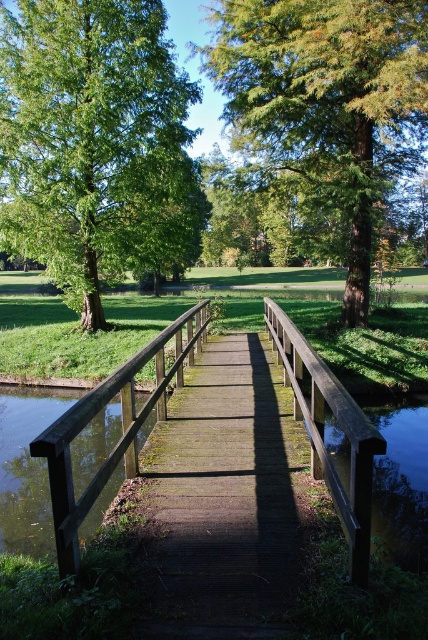
Question: Can you confirm if mossy wooden bridge at center is positioned below wooden bridge at center?

Choices:
 (A) yes
 (B) no

Answer: (A)

Question: Does green matte tree at upper left have a larger size compared to green leafy tree at center?

Choices:
 (A) no
 (B) yes

Answer: (A)

Question: Which point is closer to the camera?

Choices:
 (A) green leafy tree at center
 (B) wooden bridge at center
 (C) mossy wooden bridge at center
 (D) green matte tree at upper left

Answer: (B)

Question: Which of these objects is positioned closest to the green leafy tree at center?

Choices:
 (A) green matte tree at upper left
 (B) mossy wooden bridge at center
 (C) wooden bridge at center

Answer: (A)

Question: Which of these objects is positioned farthest from the mossy wooden bridge at center?

Choices:
 (A) green matte tree at upper left
 (B) green leafy tree at center
 (C) wooden bridge at center

Answer: (A)

Question: Is green matte tree at upper left bigger than wooden bridge at center?

Choices:
 (A) yes
 (B) no

Answer: (A)